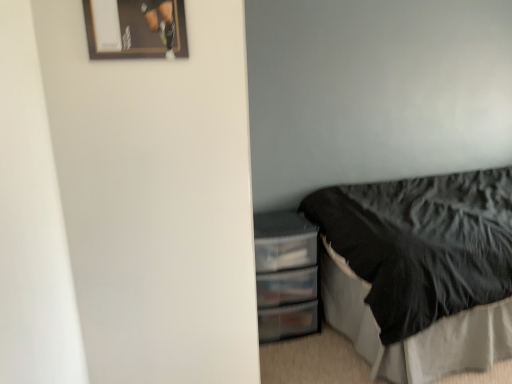
Question: Is black feathered bed at lower right turned away from wooden framed poster at upper left?

Choices:
 (A) yes
 (B) no

Answer: (B)

Question: From a real-world perspective, is black feathered bed at lower right physically above wooden framed poster at upper left?

Choices:
 (A) yes
 (B) no

Answer: (B)

Question: Is black feathered bed at lower right surrounding wooden framed poster at upper left?

Choices:
 (A) yes
 (B) no

Answer: (B)

Question: Can you confirm if black feathered bed at lower right is smaller than wooden framed poster at upper left?

Choices:
 (A) no
 (B) yes

Answer: (A)

Question: Is black feathered bed at lower right bigger than wooden framed poster at upper left?

Choices:
 (A) no
 (B) yes

Answer: (B)

Question: Is transparent plastic drawers at lower right in front of or behind black feathered bed at lower right in the image?

Choices:
 (A) front
 (B) behind

Answer: (B)

Question: In terms of width, does transparent plastic drawers at lower right look wider or thinner when compared to black feathered bed at lower right?

Choices:
 (A) wide
 (B) thin

Answer: (B)

Question: From the image's perspective, is transparent plastic drawers at lower right positioned above or below black feathered bed at lower right?

Choices:
 (A) below
 (B) above

Answer: (A)

Question: From a real-world perspective, is transparent plastic drawers at lower right positioned above or below black feathered bed at lower right?

Choices:
 (A) below
 (B) above

Answer: (A)

Question: Is black feathered bed at lower right bigger or smaller than wooden framed poster at upper left?

Choices:
 (A) big
 (B) small

Answer: (A)

Question: In the image, is black feathered bed at lower right positioned in front of or behind wooden framed poster at upper left?

Choices:
 (A) front
 (B) behind

Answer: (B)

Question: From the image's perspective, is black feathered bed at lower right positioned above or below wooden framed poster at upper left?

Choices:
 (A) below
 (B) above

Answer: (A)

Question: Is black feathered bed at lower right situated inside wooden framed poster at upper left or outside?

Choices:
 (A) inside
 (B) outside

Answer: (B)

Question: From a real-world perspective, is wooden framed poster at upper left positioned above or below black feathered bed at lower right?

Choices:
 (A) below
 (B) above

Answer: (B)

Question: Considering the positions of wooden framed poster at upper left and black feathered bed at lower right in the image, is wooden framed poster at upper left taller or shorter than black feathered bed at lower right?

Choices:
 (A) tall
 (B) short

Answer: (B)